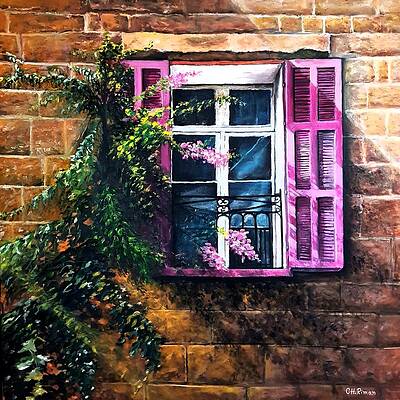
The height and width of the screenshot is (400, 400). I want to click on spot below window, so (213, 292).